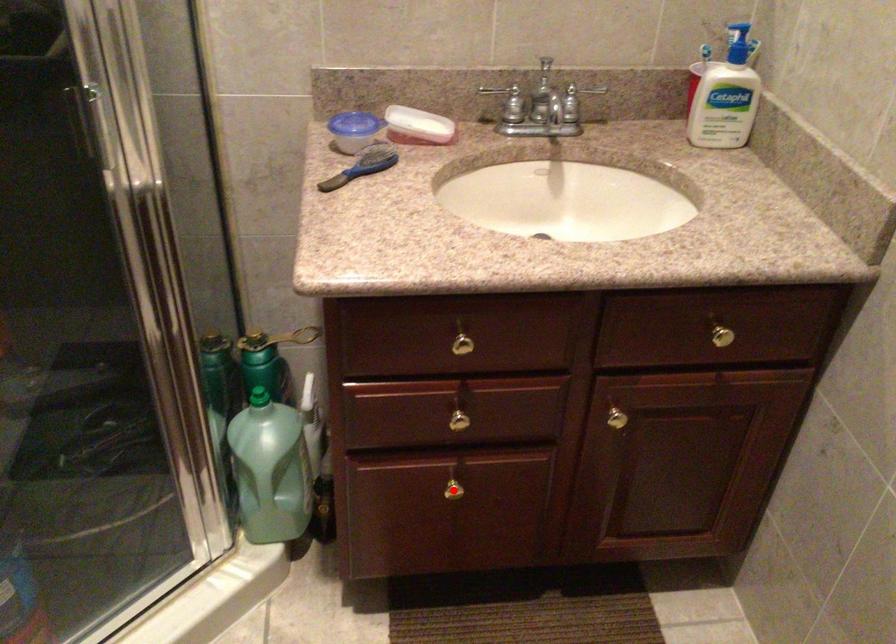
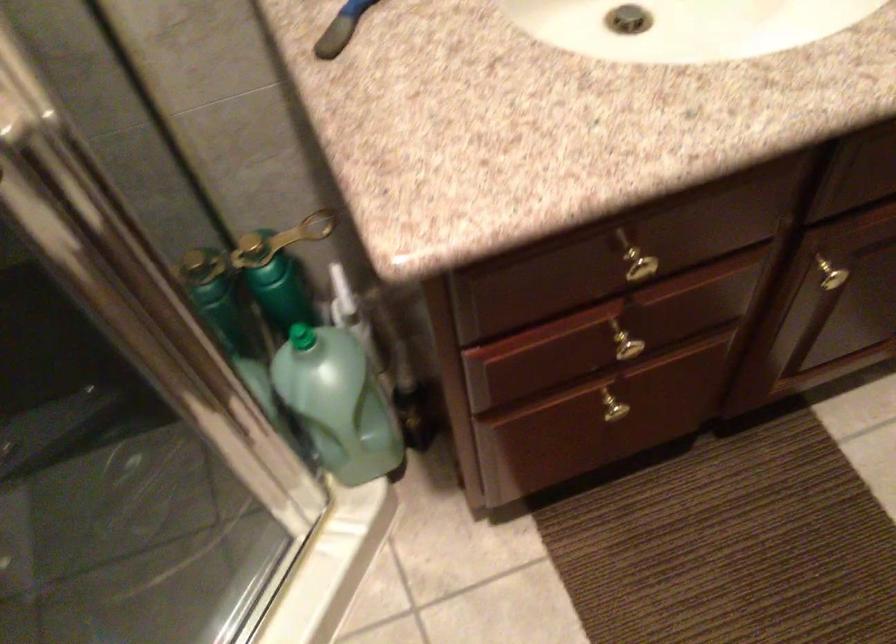
In the second image, find the point that corresponds to the highlighted location in the first image.

(616, 411)